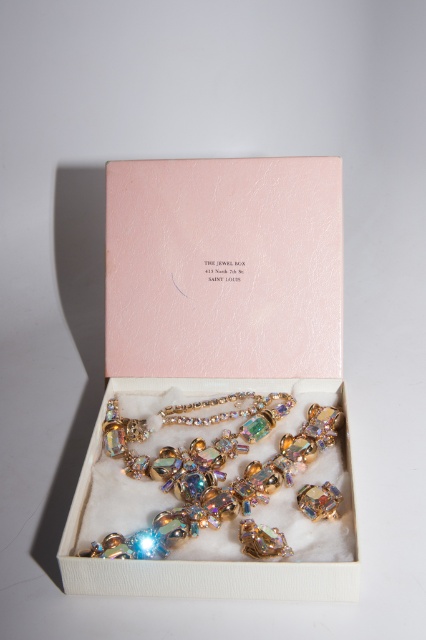
From the picture: Who is positioned more to the right, pink leather gift box at center or iridescent gold necklace at center?

Positioned to the right is iridescent gold necklace at center.

Who is more distant from viewer, (x=327, y=232) or (x=330, y=499)?

Point (x=327, y=232)

Between point (195, 308) and point (100, 513), which one is positioned behind?

The point (195, 308) is more distant.

The image size is (426, 640). Identify the location of pink leather gift box at center. (204, 339).